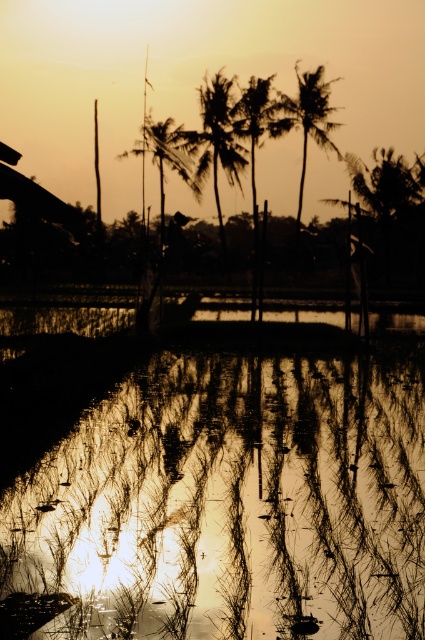
Can you confirm if shiny reflective water at center is wider than silhouette palm tree at center?

Yes.

Who is more forward, (x=374, y=371) or (x=212, y=106)?

Positioned in front is point (x=374, y=371).

Locate an element on the screen. The height and width of the screenshot is (640, 425). shiny reflective water at center is located at coordinates pos(209,477).

Is shiny reflective water at center to the right of silky green palm tree at center from the viewer's perspective?

Correct, you'll find shiny reflective water at center to the right of silky green palm tree at center.

This screenshot has height=640, width=425. In order to click on shiny reflective water at center in this screenshot , I will do `click(209, 477)`.

Does silhouette palm tree at center have a greater height compared to silhouette palm tree at upper center?

In fact, silhouette palm tree at center may be shorter than silhouette palm tree at upper center.

Can you confirm if silhouette palm tree at center is smaller than silhouette palm tree at upper center?

Yes, silhouette palm tree at center is smaller than silhouette palm tree at upper center.

Describe the element at coordinates (218, 140) in the screenshot. Image resolution: width=425 pixels, height=640 pixels. I see `silhouette palm tree at center` at that location.

Image resolution: width=425 pixels, height=640 pixels. I want to click on silhouette palm tree at center, so click(x=218, y=140).